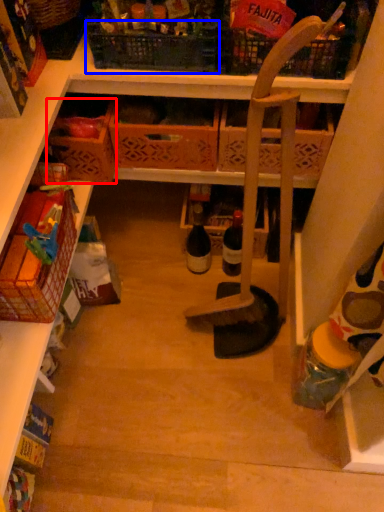
Question: Which point is closer to the camera, basket (highlighted by a red box) or basket (highlighted by a blue box)?

Choices:
 (A) basket
 (B) basket

Answer: (B)